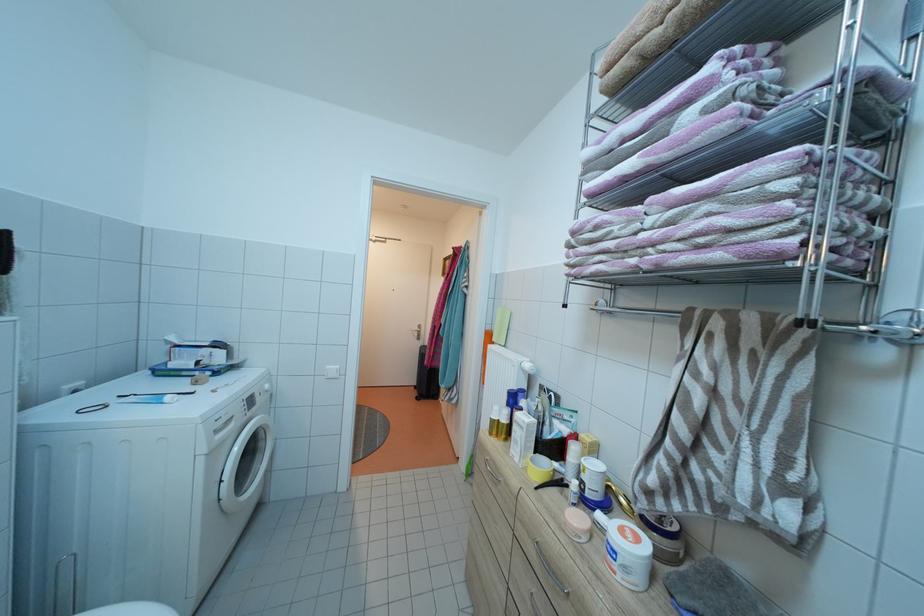
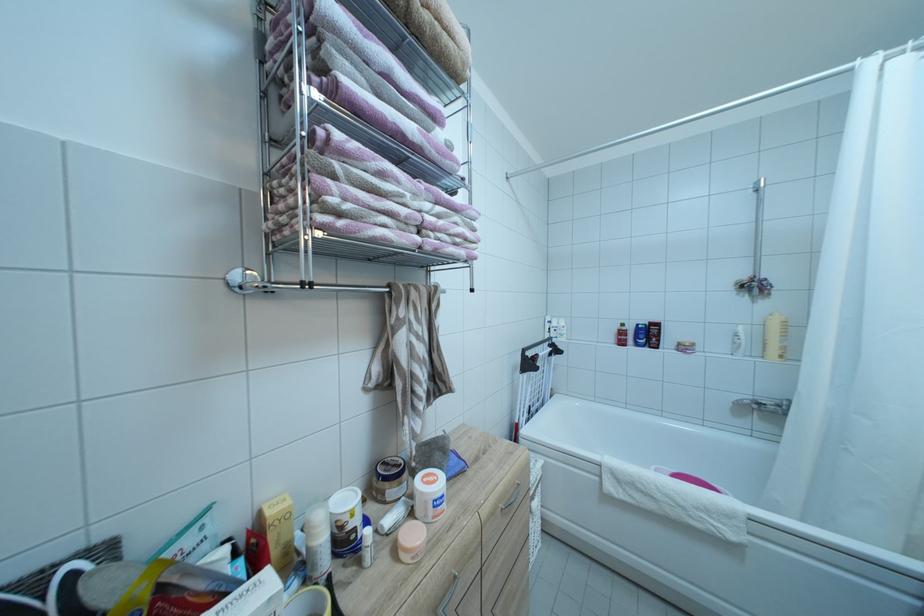
Where in the second image is the point corresponding to (x=678, y=214) from the first image?

(444, 209)